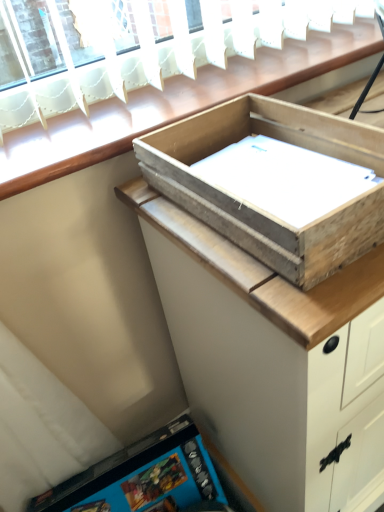
What is the approximate width of wooden tray at upper center?

The width of wooden tray at upper center is 19.19 inches.

What is the approximate height of wooden tray at upper center?

The height of wooden tray at upper center is 32.88 inches.

Locate an element on the screen. This screenshot has height=512, width=384. wooden tray at upper center is located at coordinates (273, 361).

The image size is (384, 512). Describe the element at coordinates (273, 361) in the screenshot. I see `wooden tray at upper center` at that location.

What do you see at coordinates (275, 183) in the screenshot? I see `weathered wood box at upper center` at bounding box center [275, 183].

What is the approximate height of weathered wood box at upper center?

The height of weathered wood box at upper center is 3.69 inches.

Identify the location of weathered wood box at upper center. The image size is (384, 512). click(275, 183).

Find the location of a particular element. This screenshot has width=384, height=512. wooden tray at upper center is located at coordinates (273, 361).

Looking at this image, considering the relative positions of wooden tray at upper center and weathered wood box at upper center in the image provided, is wooden tray at upper center to the left of weathered wood box at upper center from the viewer's perspective?

In fact, wooden tray at upper center is to the right of weathered wood box at upper center.

Considering their positions, is wooden tray at upper center located in front of or behind weathered wood box at upper center?

wooden tray at upper center is positioned farther from the viewer than weathered wood box at upper center.

Which is closer, [203,420] or [372,189]?

Positioned in front is point [372,189].

From the image's perspective, which one is positioned lower, wooden tray at upper center or weathered wood box at upper center?

→ wooden tray at upper center.

From a real-world perspective, between wooden tray at upper center and weathered wood box at upper center, who is vertically lower?

From a 3D spatial view, wooden tray at upper center is below.

Consider the image. Which of these two, wooden tray at upper center or weathered wood box at upper center, is wider?

wooden tray at upper center.

Who is shorter, wooden tray at upper center or weathered wood box at upper center?

Standing shorter between the two is weathered wood box at upper center.

Between wooden tray at upper center and weathered wood box at upper center, which one has larger size?

wooden tray at upper center is bigger.

Is weathered wood box at upper center completely or partially inside wooden tray at upper center?

Definitely not — weathered wood box at upper center is not inside wooden tray at upper center.

Is wooden tray at upper center not close to weathered wood box at upper center?

No, there isn't a large distance between wooden tray at upper center and weathered wood box at upper center.

Is wooden tray at upper center looking in the opposite direction of weathered wood box at upper center?

No, wooden tray at upper center's orientation is not away from weathered wood box at upper center.

How many degrees apart are the facing directions of wooden tray at upper center and weathered wood box at upper center?

The facing directions of wooden tray at upper center and weathered wood box at upper center are 0.00163 degrees apart.

The image size is (384, 512). I want to click on box on the left side of wooden tray at upper center, so click(x=275, y=183).

Between weathered wood box at upper center and wooden tray at upper center, which one appears on the left side from the viewer's perspective?

Positioned to the left is weathered wood box at upper center.

Between weathered wood box at upper center and wooden tray at upper center, which one is positioned behind?

wooden tray at upper center is further from the camera.

Which point is more forward, (266, 150) or (367, 462)?

The point (266, 150) is closer.

From the image's perspective, which one is positioned lower, weathered wood box at upper center or wooden tray at upper center?

wooden tray at upper center appears lower in the image.

Looking at this image, from a real-world perspective, does weathered wood box at upper center stand above wooden tray at upper center?

Yes.

Can you confirm if weathered wood box at upper center is wider than wooden tray at upper center?

In fact, weathered wood box at upper center might be narrower than wooden tray at upper center.

Can you confirm if weathered wood box at upper center is taller than wooden tray at upper center?

In fact, weathered wood box at upper center may be shorter than wooden tray at upper center.

Can you confirm if weathered wood box at upper center is smaller than wooden tray at upper center?

Yes.

Looking at this image, would you say wooden tray at upper center is part of weathered wood box at upper center's contents?

Actually, wooden tray at upper center is outside weathered wood box at upper center.

Is weathered wood box at upper center positioned far away from wooden tray at upper center?

No, there isn't a large distance between weathered wood box at upper center and wooden tray at upper center.

Is weathered wood box at upper center positioned with its back to wooden tray at upper center?

No, wooden tray at upper center is not at the back of weathered wood box at upper center.

How different are the orientations of weathered wood box at upper center and wooden tray at upper center in degrees?

0.00163 degrees.

How much distance is there between weathered wood box at upper center and wooden tray at upper center?

7.79 inches.

Image resolution: width=384 pixels, height=512 pixels. In the image, there is a wooden tray at upper center. In order to click on box above it (from the image's perspective) in this screenshot , I will do `click(275, 183)`.

Where is `box above the wooden tray at upper center (from the image's perspective)`? box above the wooden tray at upper center (from the image's perspective) is located at coordinates (275, 183).

The height and width of the screenshot is (512, 384). In order to click on box that appears above the wooden tray at upper center (from a real-world perspective) in this screenshot , I will do `click(275, 183)`.